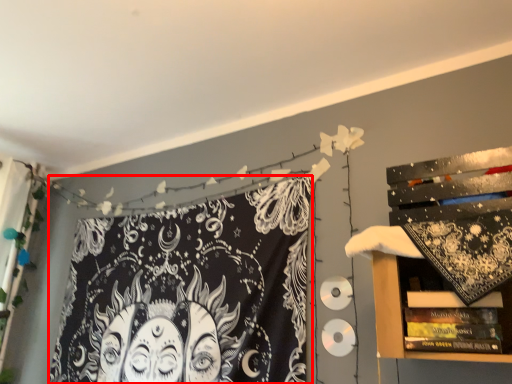
Question: From the image's perspective, what is the correct spatial relationship of fabric (annotated by the red box) in relation to shelf?

Choices:
 (A) above
 (B) below

Answer: (B)